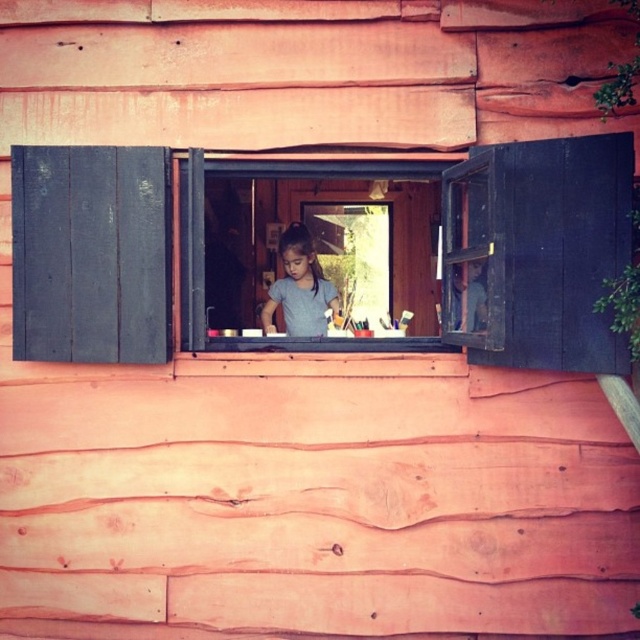
Is wooden window at center positioned at the back of dark gray wood shutter at left?

Yes, wooden window at center is further from the viewer.

Who is more distant from viewer, (365, 161) or (22, 268)?

Positioned behind is point (365, 161).

At what (x,y) coordinates should I click in order to perform the action: click on wooden window at center. Please return your answer as a coordinate pair (x, y). Looking at the image, I should click on (307, 250).

How distant is dark gray wood shutter at left from gray matte shirt at center?

dark gray wood shutter at left and gray matte shirt at center are 5.88 feet apart from each other.

Can you confirm if dark gray wood shutter at left is taller than gray matte shirt at center?

Yes.

Between point (164, 168) and point (276, 298), which one is positioned behind?

Point (276, 298)

Identify the location of dark gray wood shutter at left. (90, 253).

Who is taller, wooden window at center or gray matte shirt at center?

With more height is wooden window at center.

Between point (344, 310) and point (284, 308), which one is positioned in front?

Positioned in front is point (284, 308).

Find the location of `wooden window at center`. wooden window at center is located at coordinates (307, 250).